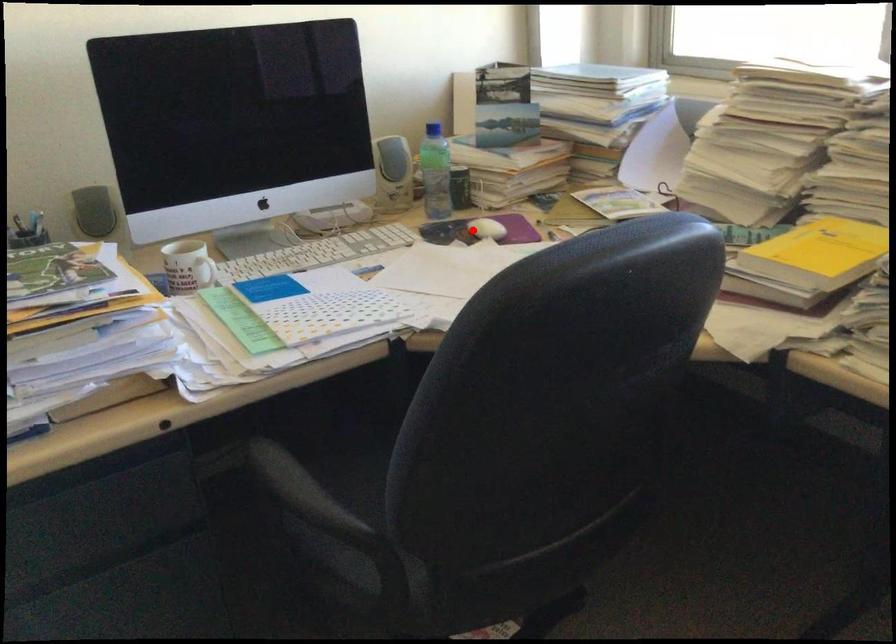
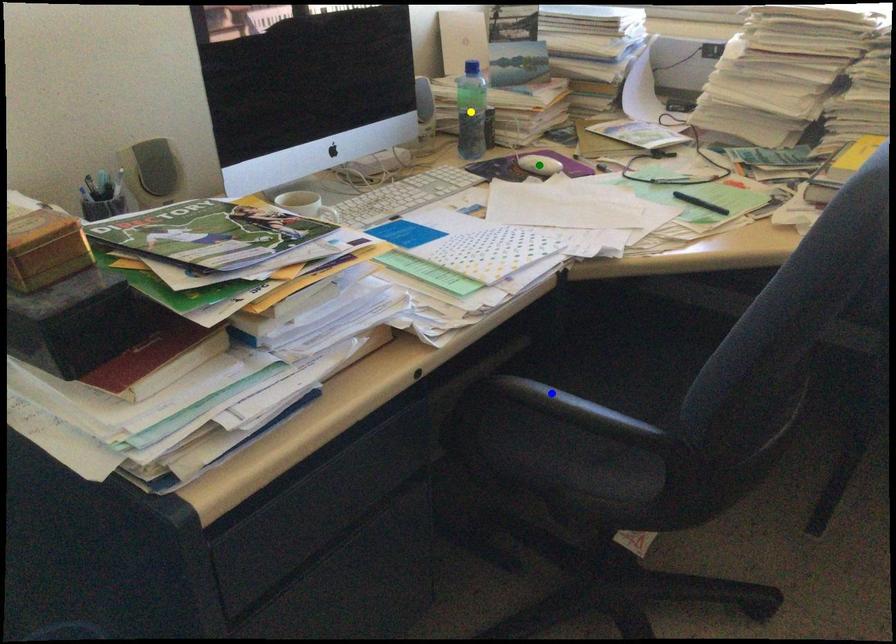
Question: I am providing you with two images of the same scene from different viewpoints. A red point is marked on the first image. You are given multiple points on the second image. Which mark in image 2 goes with the point in image 1?

Choices:
 (A) blue point
 (B) yellow point
 (C) green point

Answer: (C)